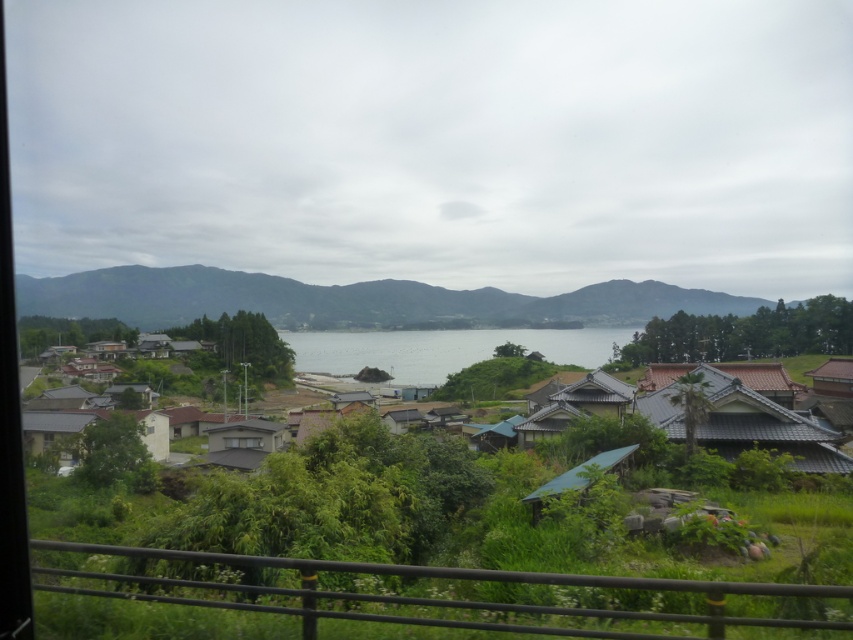
Between point (408, 380) and point (253, 460), which one is positioned behind?

Positioned behind is point (408, 380).

The image size is (853, 640). What are the coordinates of `brown tiled roofs at center` in the screenshot? It's located at (431, 349).

Locate an element on the screen. This screenshot has width=853, height=640. brown tiled roofs at center is located at coordinates (431, 349).

Which is behind, point (527, 332) or point (817, 365)?

The point (527, 332) is behind.

Describe the element at coordinates (444, 349) in the screenshot. I see `clear water at center` at that location.

Which is behind, point (341, 342) or point (849, 360)?

The point (341, 342) is more distant.

Find the location of `clear water at center`. clear water at center is located at coordinates (444, 349).

Does brown tiled roofs at center appear over brown corrugated roof at right?

Incorrect, brown tiled roofs at center is not positioned above brown corrugated roof at right.

The height and width of the screenshot is (640, 853). What do you see at coordinates (431, 349) in the screenshot? I see `brown tiled roofs at center` at bounding box center [431, 349].

Where is `brown tiled roofs at center`? This screenshot has height=640, width=853. brown tiled roofs at center is located at coordinates (431, 349).